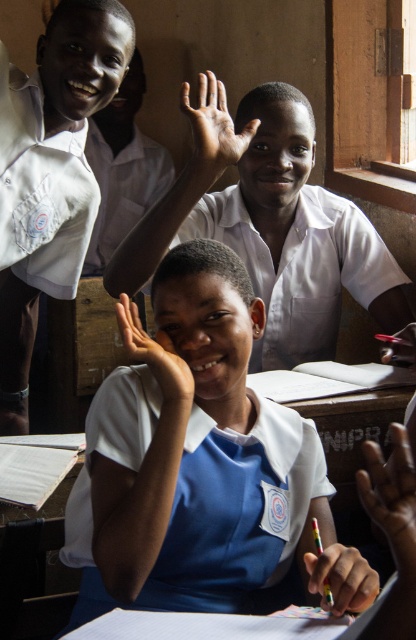
Question: Does white glossy uniform at upper center lie behind light skin hand at upper center?

Choices:
 (A) no
 (B) yes

Answer: (B)

Question: Which point appears closest to the camera in this image?

Choices:
 (A) [321, 557]
 (B) [383, 362]
 (C) [140, 189]
 (D) [192, 154]

Answer: (A)

Question: Can you confirm if white glossy uniform at upper center is positioned above metallic pen at upper right?

Choices:
 (A) no
 (B) yes

Answer: (B)

Question: Among these points, which one is nearest to the camera?

Choices:
 (A) (111, 212)
 (B) (168, 374)
 (C) (183, 104)

Answer: (B)

Question: Which point appears closest to the camera in this image?

Choices:
 (A) (247, 390)
 (B) (413, 326)

Answer: (A)

Question: Is white smooth uniform at center wider than dark skin hand at center?

Choices:
 (A) no
 (B) yes

Answer: (B)